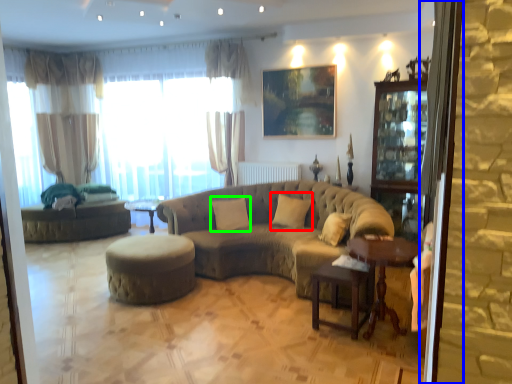
Question: Considering the real-world distances, which object is closest to pillow (highlighted by a red box)? screen door (highlighted by a blue box) or pillow (highlighted by a green box).

Choices:
 (A) screen door
 (B) pillow

Answer: (B)